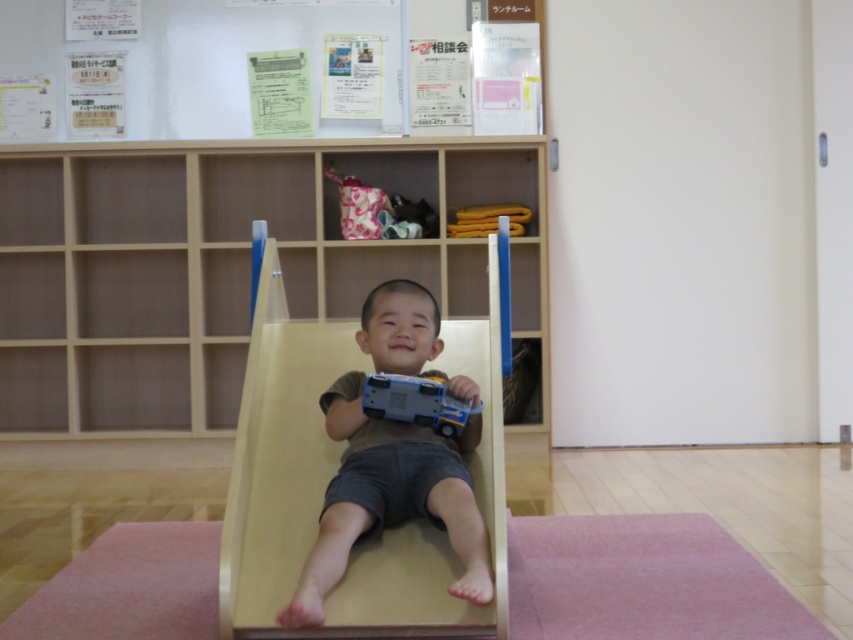
Can you confirm if pink carpet at lower center is smaller than shiny blue plastic toy car at center?

No.

Is pink carpet at lower center taller than shiny blue plastic toy car at center?

Incorrect, pink carpet at lower center's height is not larger of shiny blue plastic toy car at center's.

Who is more distant from viewer, [102,573] or [438,428]?

The point [102,573] is more distant.

You are a GUI agent. You are given a task and a screenshot of the screen. Output one action in this format:
    pyautogui.click(x=<x>, y=<y>)
    Task: Click on the pink carpet at lower center
    
    Given the screenshot: What is the action you would take?
    pyautogui.click(x=643, y=580)

Is point (424, 515) positioned after point (451, 208)?

No, it is in front of (451, 208).

Is light brown wooden slide at center further to the viewer compared to yellow fabric at upper center?

That is False.

At what (x,y) coordinates should I click in order to perform the action: click on light brown wooden slide at center. Please return your answer as a coordinate pair (x, y). Looking at the image, I should click on 389,500.

The image size is (853, 640). What are the coordinates of `shiny blue plastic toy car at center` in the screenshot? It's located at (415, 403).

Is point (418, 381) closer to camera compared to point (480, 209)?

Yes, it is in front of point (480, 209).

Is point (397, 406) closer to camera compared to point (468, 218)?

Yes.

The image size is (853, 640). I want to click on shiny blue plastic toy car at center, so (x=415, y=403).